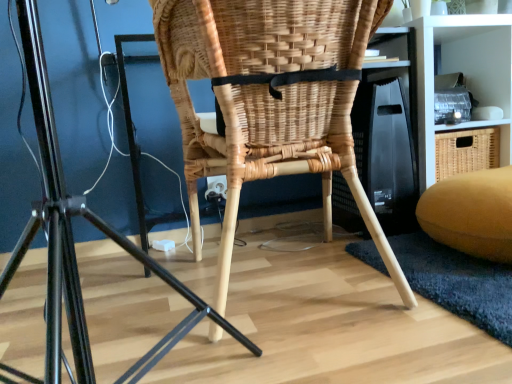
Question: Does white matte shelf at upper right have a smaller size compared to natural wicker chair at center?

Choices:
 (A) yes
 (B) no

Answer: (A)

Question: From the image's perspective, is white matte shelf at upper right over natural wicker chair at center?

Choices:
 (A) yes
 (B) no

Answer: (A)

Question: Is white matte shelf at upper right aimed at natural wicker chair at center?

Choices:
 (A) no
 (B) yes

Answer: (A)

Question: Is white matte shelf at upper right facing away from natural wicker chair at center?

Choices:
 (A) no
 (B) yes

Answer: (A)

Question: Is white matte shelf at upper right in contact with natural wicker chair at center?

Choices:
 (A) yes
 (B) no

Answer: (B)

Question: Considering the relative positions of white matte shelf at upper right and natural wicker chair at center in the image provided, is white matte shelf at upper right in front of natural wicker chair at center?

Choices:
 (A) yes
 (B) no

Answer: (B)

Question: Can velvet yellow bean bag at lower right be found inside natural wicker chair at center?

Choices:
 (A) yes
 (B) no

Answer: (B)

Question: Is natural wicker chair at center placed right next to velvet yellow bean bag at lower right?

Choices:
 (A) no
 (B) yes

Answer: (A)

Question: Is natural wicker chair at center far from velvet yellow bean bag at lower right?

Choices:
 (A) no
 (B) yes

Answer: (A)

Question: Can you confirm if natural wicker chair at center is thinner than velvet yellow bean bag at lower right?

Choices:
 (A) no
 (B) yes

Answer: (A)

Question: Can you confirm if natural wicker chair at center is taller than velvet yellow bean bag at lower right?

Choices:
 (A) no
 (B) yes

Answer: (B)

Question: Does natural wicker chair at center have a smaller size compared to velvet yellow bean bag at lower right?

Choices:
 (A) no
 (B) yes

Answer: (A)

Question: Does white matte shelf at upper right lie in front of natural woven chair at center?

Choices:
 (A) no
 (B) yes

Answer: (A)